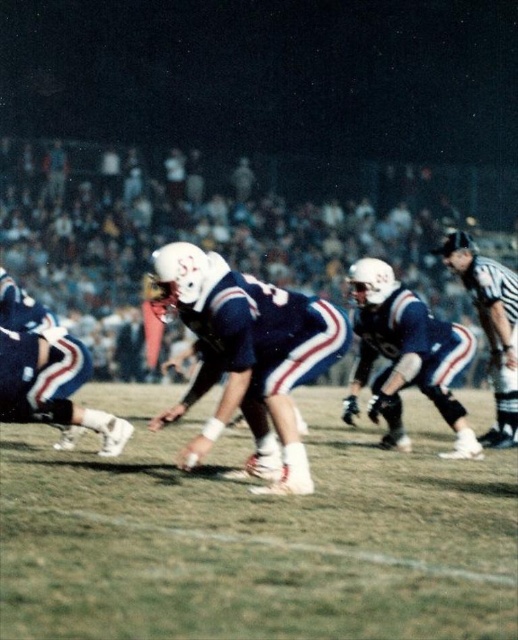
You are a photographer at the football game and want to capture both the blue fabric uniform at center and the black uniformed figure at right in a single shot. Which player should you focus on to ensure the larger subject is in the foreground?

The blue fabric uniform at center is bigger than the black uniformed figure at right, so you should focus on the blue fabric uniform at center to ensure the larger subject is in the foreground.

You are a photographer at the football game and want to capture both the blue fabric uniform at center and the black uniformed figure at right in a single shot. Given that your camera has a fixed focal length, which player should you position closer to the center of your frame to ensure both are fully visible?

The blue fabric uniform at center has a larger width than the black uniformed figure at right. To ensure both are fully visible in the shot, position the blue fabric uniform at center closer to the center of the frame since its larger size requires more space in the composition.